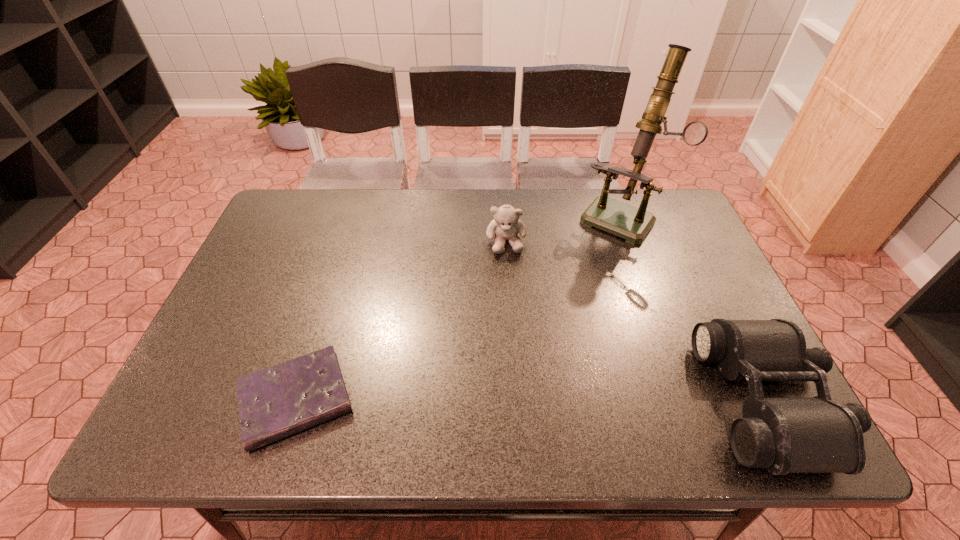
You are a GUI agent. You are given a task and a screenshot of the screen. Output one action in this format:
    pyautogui.click(x=<x>, y=<y>)
    Task: Click on the diary
    
    Given the screenshot: What is the action you would take?
    pyautogui.click(x=279, y=401)

At what (x,y) coordinates should I click in order to perform the action: click on the shortest object. Please return your answer as a coordinate pair (x, y). Looking at the image, I should click on (279, 401).

Find the location of a particular element. binoculars is located at coordinates (783, 435).

The image size is (960, 540). In order to click on teddy bear in this screenshot , I will do `click(506, 224)`.

Identify the location of the second object from left to right. [x=506, y=224].

Find the location of a particular element. microscope is located at coordinates (626, 221).

You are a GUI agent. You are given a task and a screenshot of the screen. Output one action in this format:
    pyautogui.click(x=<x>, y=<y>)
    Task: Click on the vacant position located on the right of the shortest object
    The width and height of the screenshot is (960, 540).
    Given the screenshot: What is the action you would take?
    pyautogui.click(x=440, y=400)

At what (x,y) coordinates should I click in order to perform the action: click on vacant space positioned 0.310m on the face of the second tallest object. Please return your answer as a coordinate pair (x, y). The height and width of the screenshot is (540, 960). Looking at the image, I should click on pyautogui.click(x=514, y=348).

I want to click on vacant space situated on the face of the second tallest object, so click(516, 382).

In order to click on vacant space located 0.310m on the face of the second tallest object in this screenshot , I will do `click(514, 348)`.